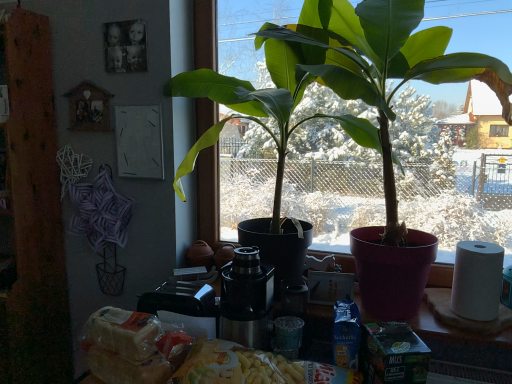
The height and width of the screenshot is (384, 512). What do you see at coordinates (477, 280) in the screenshot?
I see `white matte paper towel at right` at bounding box center [477, 280].

Locate an element on the screen. stainless steel coffee machine at center is located at coordinates (246, 299).

Locate an element on the screen. white matte paper towel at right is located at coordinates (477, 280).

Which is correct: green matte plant at center is inside white matte paper towel at right, or outside of it?

The correct answer is: outside.

Could you tell me if green matte plant at center is facing white matte paper towel at right?

Yes, green matte plant at center is facing white matte paper towel at right.

From a real-world perspective, is green matte plant at center on white matte paper towel at right?

Yes, from a real-world perspective, green matte plant at center is over white matte paper towel at right

Is green matte plant at center directly adjacent to stainless steel coffee machine at center?

No, green matte plant at center is not beside stainless steel coffee machine at center.

Does point (385, 189) lie in front of point (258, 305)?

That is False.

Is green matte plant at center shorter than stainless steel coffee machine at center?

Incorrect, the height of green matte plant at center does not fall short of that of stainless steel coffee machine at center.

Considering the relative sizes of green matte plant at center and stainless steel coffee machine at center in the image provided, is green matte plant at center bigger than stainless steel coffee machine at center?

Indeed, green matte plant at center has a larger size compared to stainless steel coffee machine at center.

From the image's perspective, between yellow matte pasta at lower center and green matte plant at center, who is located below?

yellow matte pasta at lower center, from the image's perspective.

Which is behind, yellow matte pasta at lower center or green matte plant at center?

green matte plant at center is further away from the camera.

Which object is positioned more to the left, yellow matte pasta at lower center or green matte plant at center?

Positioned to the left is yellow matte pasta at lower center.

Is point (267, 362) positioned after point (306, 33)?

No, it is not.

From a real-world perspective, relative to green matte plant at center, is white matte paper towel at right vertically above or below?

In terms of real-world spatial position, white matte paper towel at right is below green matte plant at center.

In the scene shown: In the image, is white matte paper towel at right positioned in front of or behind green matte plant at center?

white matte paper towel at right is positioned farther from the viewer than green matte plant at center.

Considering the relative sizes of white matte paper towel at right and green matte plant at center in the image provided, is white matte paper towel at right thinner than green matte plant at center?

Yes, white matte paper towel at right is thinner than green matte plant at center.

Consider the image. Is white matte paper towel at right oriented away from green matte plant at center?

Absolutely, white matte paper towel at right is directed away from green matte plant at center.

Is green matte plant at center spatially inside yellow matte pasta at lower center, or outside of it?

green matte plant at center is not enclosed by yellow matte pasta at lower center.

Looking at the image, does green matte plant at center seem bigger or smaller compared to yellow matte pasta at lower center?

Clearly, green matte plant at center is larger in size than yellow matte pasta at lower center.

How different are the orientations of green matte plant at center and yellow matte pasta at lower center in degrees?

They differ by 0.0841 degrees in their facing directions.

Which of these two, green matte plant at center or yellow matte pasta at lower center, stands taller?

green matte plant at center.

From a real-world perspective, is stainless steel coffee machine at center physically above white matte paper towel at right?

No, from a real-world perspective, stainless steel coffee machine at center is not on top of white matte paper towel at right.

Considering the points (261, 333) and (499, 250), which point is in front, point (261, 333) or point (499, 250)?

The point (499, 250) is closer.

I want to click on paper towel above the stainless steel coffee machine at center (from the image's perspective), so click(477, 280).

Does stainless steel coffee machine at center have a lesser height compared to white matte paper towel at right?

No.

Between white matte paper towel at right and yellow matte pasta at lower center, which one has less height?

With less height is yellow matte pasta at lower center.

Looking at this image, considering their positions, is white matte paper towel at right located in front of or behind yellow matte pasta at lower center?

In the image, white matte paper towel at right appears behind yellow matte pasta at lower center.

Looking at this image, from the image's perspective, which is above, white matte paper towel at right or yellow matte pasta at lower center?

white matte paper towel at right, from the image's perspective.

At what (x,y) coordinates should I click in order to perform the action: click on houseplant in front of the white matte paper towel at right. Please return your answer as a coordinate pair (x, y). The width and height of the screenshot is (512, 384). Looking at the image, I should click on (341, 80).

At what (x,y) coordinates should I click in order to perform the action: click on coffee machine below the green matte plant at center (from a real-world perspective). Please return your answer as a coordinate pair (x, y). This screenshot has height=384, width=512. Looking at the image, I should click on (246, 299).

From the image, which object appears to be farther from white matte paper towel at right, stainless steel coffee machine at center or green matte plant at center?

stainless steel coffee machine at center is positioned further to the anchor white matte paper towel at right.

Based on their spatial positions, is green matte plant at center or white matte paper towel at right closer to stainless steel coffee machine at center?

green matte plant at center lies closer to stainless steel coffee machine at center than the other object.

Which object lies nearer to the anchor point yellow matte pasta at lower center, stainless steel coffee machine at center or green matte plant at center?

Among the two, stainless steel coffee machine at center is located nearer to yellow matte pasta at lower center.

When comparing their distances from stainless steel coffee machine at center, does green matte plant at center or yellow matte pasta at lower center seem closer?

Based on the image, yellow matte pasta at lower center appears to be nearer to stainless steel coffee machine at center.

Based on the photo, estimate the real-world distances between objects in this image. Which object is further from yellow matte pasta at lower center, stainless steel coffee machine at center or white matte paper towel at right?

white matte paper towel at right lies further to yellow matte pasta at lower center than the other object.

Which object lies further to the anchor point white matte paper towel at right, yellow matte pasta at lower center or stainless steel coffee machine at center?

Among the two, stainless steel coffee machine at center is located further to white matte paper towel at right.

Based on their spatial positions, is yellow matte pasta at lower center or white matte paper towel at right further from stainless steel coffee machine at center?

Based on the image, white matte paper towel at right appears to be further to stainless steel coffee machine at center.

Considering their positions, is white matte paper towel at right positioned further to yellow matte pasta at lower center than green matte plant at center?

green matte plant at center is positioned further to the anchor yellow matte pasta at lower center.

Find the location of `food between stainless steel coffee machine at center and white matte paper towel at right`. food between stainless steel coffee machine at center and white matte paper towel at right is located at coordinates (220, 364).

Find the location of a particular element. coffee machine that lies between green matte plant at center and yellow matte pasta at lower center from top to bottom is located at coordinates (246, 299).

Where is `houseplant between stainless steel coffee machine at center and white matte paper towel at right from left to right`? This screenshot has height=384, width=512. houseplant between stainless steel coffee machine at center and white matte paper towel at right from left to right is located at coordinates (341, 80).

Locate an element on the screen. This screenshot has width=512, height=384. paper towel between green matte plant at center and yellow matte pasta at lower center from top to bottom is located at coordinates (477, 280).